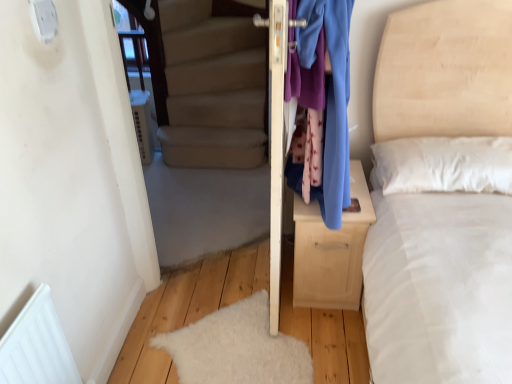
Question: Would you say light wood/texture nightstand at center is to the left or to the right of white fluffy mat at lower left in the picture?

Choices:
 (A) left
 (B) right

Answer: (B)

Question: Looking at their shapes, would you say light wood/texture nightstand at center is wider or thinner than white fluffy mat at lower left?

Choices:
 (A) wide
 (B) thin

Answer: (B)

Question: Which of these objects is positioned closest to the white fluffy mat at lower left?

Choices:
 (A) light wood/texture nightstand at center
 (B) blue fabric at right

Answer: (A)

Question: Estimate the real-world distances between objects in this image. Which object is farther from the blue fabric at right?

Choices:
 (A) light wood/texture nightstand at center
 (B) white fluffy mat at lower left

Answer: (B)